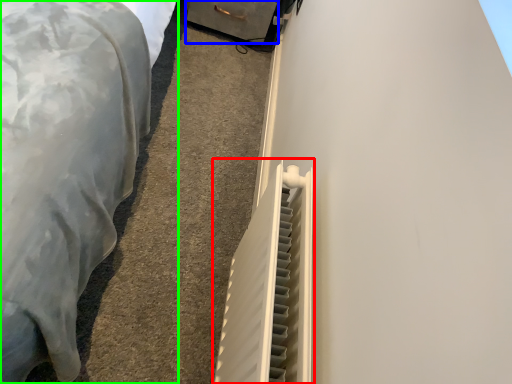
Question: Estimate the real-world distances between objects in this image. Which object is closer to radiator (highlighted by a red box), drawer (highlighted by a blue box) or furniture (highlighted by a green box)?

Choices:
 (A) drawer
 (B) furniture

Answer: (B)